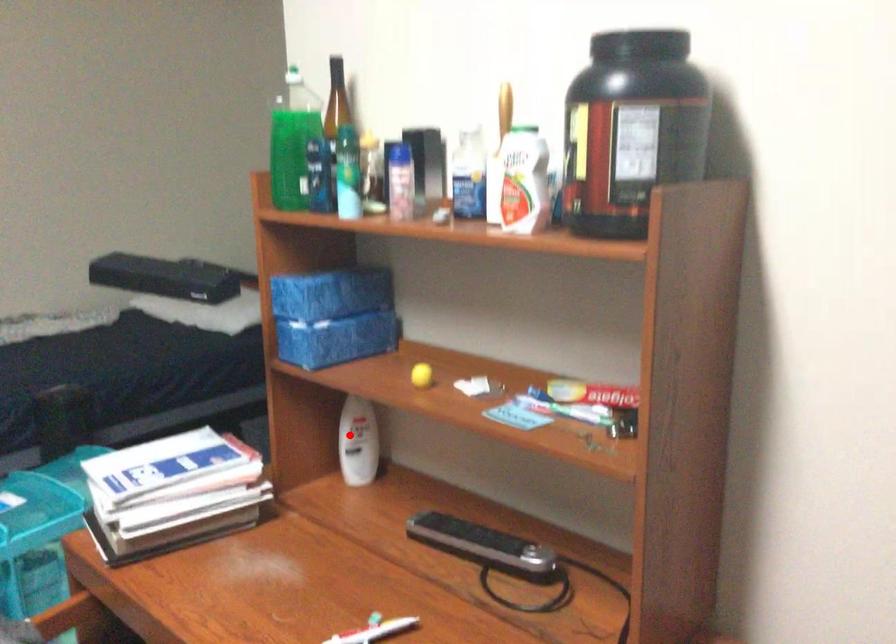
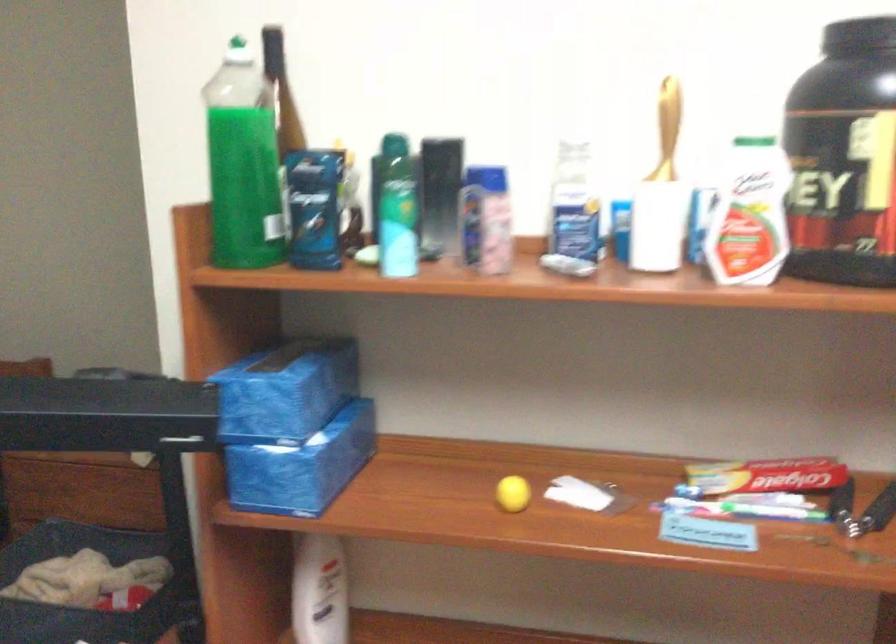
Question: I am providing you with two images of the same scene from different viewpoints. Image1 has a red point marked. In image2, the corresponding 3D location appears at what relative position? Reply with the corresponding letter.

Choices:
 (A) Closer
 (B) Farther

Answer: (A)